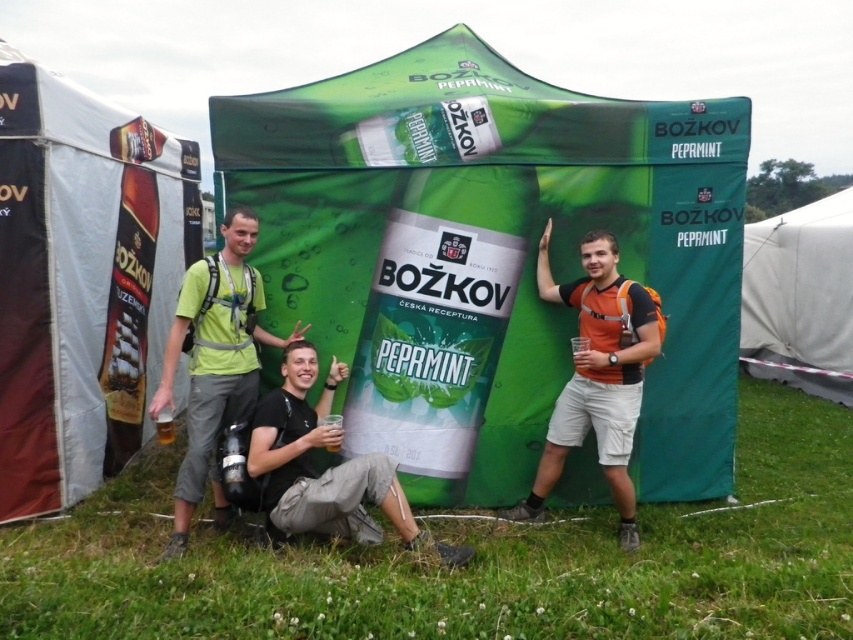
Does green grass at lower center have a smaller size compared to orange fabric backpack at right?

Correct, green grass at lower center occupies less space than orange fabric backpack at right.

Where is `green grass at lower center`? The height and width of the screenshot is (640, 853). green grass at lower center is located at coordinates (474, 561).

Find the location of a particular element. This screenshot has width=853, height=640. green grass at lower center is located at coordinates (474, 561).

Looking at this image, between black fabric tent at left and orange fabric backpack at right, which one appears on the right side from the viewer's perspective?

orange fabric backpack at right is more to the right.

Does black fabric tent at left have a larger size compared to orange fabric backpack at right?

Yes, black fabric tent at left is bigger than orange fabric backpack at right.

Who is more distant from viewer, (67, 464) or (618, 301)?

Positioned behind is point (67, 464).

Find the location of `black fabric tent at left`. black fabric tent at left is located at coordinates tap(80, 280).

Can you confirm if green fabric backpack at center is wider than white fabric tent at lower right?

Incorrect, green fabric backpack at center's width does not surpass white fabric tent at lower right's.

Which of these two, green fabric backpack at center or white fabric tent at lower right, stands taller?

With more height is white fabric tent at lower right.

Who is more distant from viewer, (245,317) or (850,276)?

Positioned behind is point (850,276).

This screenshot has width=853, height=640. I want to click on green fabric backpack at center, so click(215, 364).